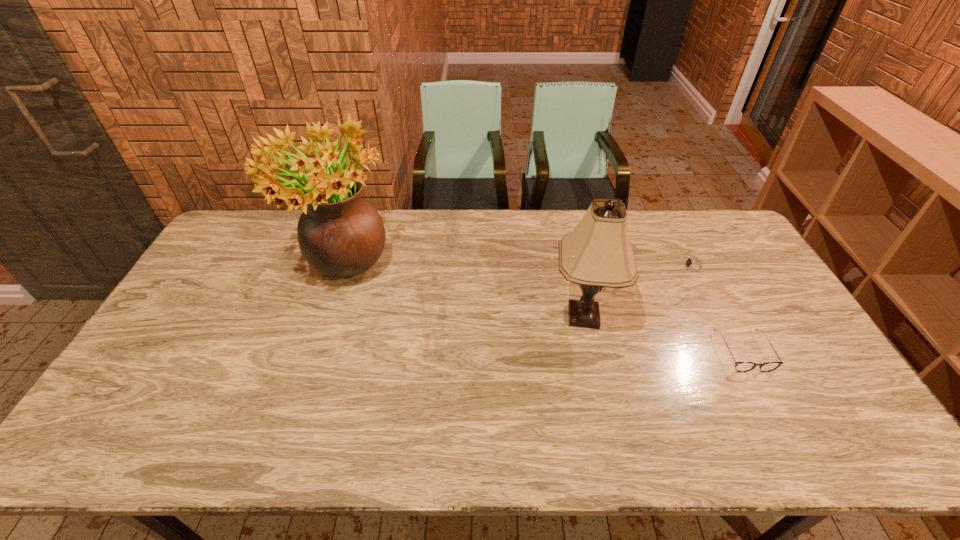
In order to click on the leftmost object in this screenshot , I will do `click(340, 234)`.

I want to click on the second tallest object, so click(x=596, y=254).

At what (x,y) coordinates should I click in order to perform the action: click on the third object from right to left. Please return your answer as a coordinate pair (x, y). The width and height of the screenshot is (960, 540). Looking at the image, I should click on (596, 254).

At what (x,y) coordinates should I click in order to perform the action: click on spectacles. Please return your answer as a coordinate pair (x, y). Looking at the image, I should click on (739, 366).

Identify the location of watch. This screenshot has width=960, height=540. (692, 265).

You are a GUI agent. You are given a task and a screenshot of the screen. Output one action in this format:
    pyautogui.click(x=<x>, y=<y>)
    Task: Click on the free space located 0.210m on the left of the flower arrangement
    This screenshot has width=960, height=540.
    Given the screenshot: What is the action you would take?
    pyautogui.click(x=229, y=272)

This screenshot has width=960, height=540. I want to click on vacant area situated 0.060m on the left of the third shortest object, so click(528, 316).

Where is `vacant space located 0.100m through the lenses of the spectacles`? This screenshot has width=960, height=540. vacant space located 0.100m through the lenses of the spectacles is located at coordinates (772, 407).

This screenshot has height=540, width=960. Find the location of `vacant space situated on the face of the watch`. vacant space situated on the face of the watch is located at coordinates [585, 266].

The image size is (960, 540). In order to click on vacant region located on the face of the watch in this screenshot , I will do `click(602, 266)`.